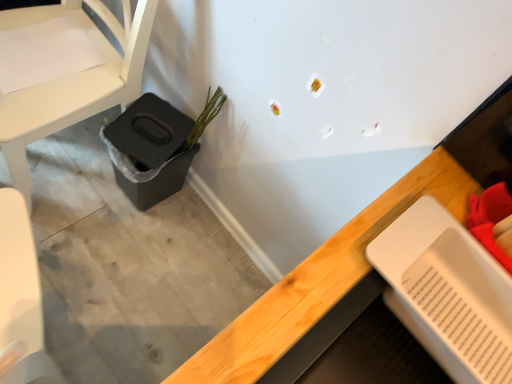
Question: Is black plastic potty at lower left not inside white matte chair at left?

Choices:
 (A) no
 (B) yes

Answer: (B)

Question: From the image's perspective, is black plastic potty at lower left under white matte chair at left?

Choices:
 (A) yes
 (B) no

Answer: (A)

Question: Does black plastic potty at lower left turn towards white matte chair at left?

Choices:
 (A) yes
 (B) no

Answer: (B)

Question: From a real-world perspective, is black plastic potty at lower left on white matte chair at left?

Choices:
 (A) yes
 (B) no

Answer: (B)

Question: Does black plastic potty at lower left have a greater height compared to white matte chair at left?

Choices:
 (A) yes
 (B) no

Answer: (B)

Question: Based on their positions, is white matte chair at left located to the left or right of white plastic tray at lower right?

Choices:
 (A) left
 (B) right

Answer: (A)

Question: Looking at the image, does white matte chair at left seem bigger or smaller compared to white plastic tray at lower right?

Choices:
 (A) big
 (B) small

Answer: (A)

Question: Is point (53, 105) closer or farther from the camera than point (382, 193)?

Choices:
 (A) farther
 (B) closer

Answer: (A)

Question: From the image's perspective, relative to white plastic tray at lower right, is white matte chair at left above or below?

Choices:
 (A) below
 (B) above

Answer: (B)

Question: Is black plastic potty at lower left taller or shorter than green matte plant at lower left?

Choices:
 (A) short
 (B) tall

Answer: (B)

Question: Would you say black plastic potty at lower left is inside or outside green matte plant at lower left?

Choices:
 (A) outside
 (B) inside

Answer: (A)

Question: From a real-world perspective, is black plastic potty at lower left above or below green matte plant at lower left?

Choices:
 (A) below
 (B) above

Answer: (A)

Question: Visually, is black plastic potty at lower left positioned to the left or to the right of green matte plant at lower left?

Choices:
 (A) right
 (B) left

Answer: (B)

Question: From a real-world perspective, is white matte chair at left positioned above or below green matte plant at lower left?

Choices:
 (A) above
 (B) below

Answer: (B)

Question: In terms of width, does white matte chair at left look wider or thinner when compared to green matte plant at lower left?

Choices:
 (A) wide
 (B) thin

Answer: (A)